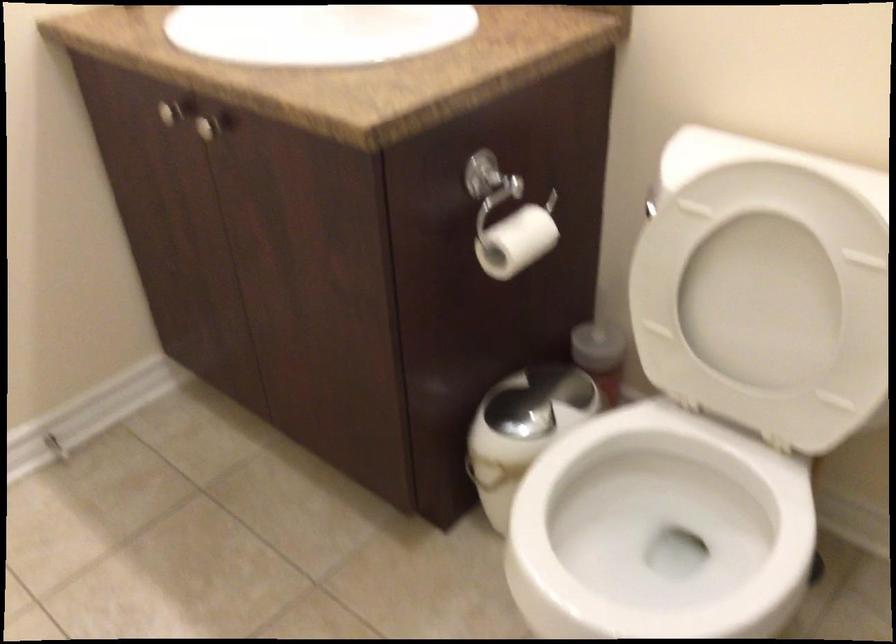
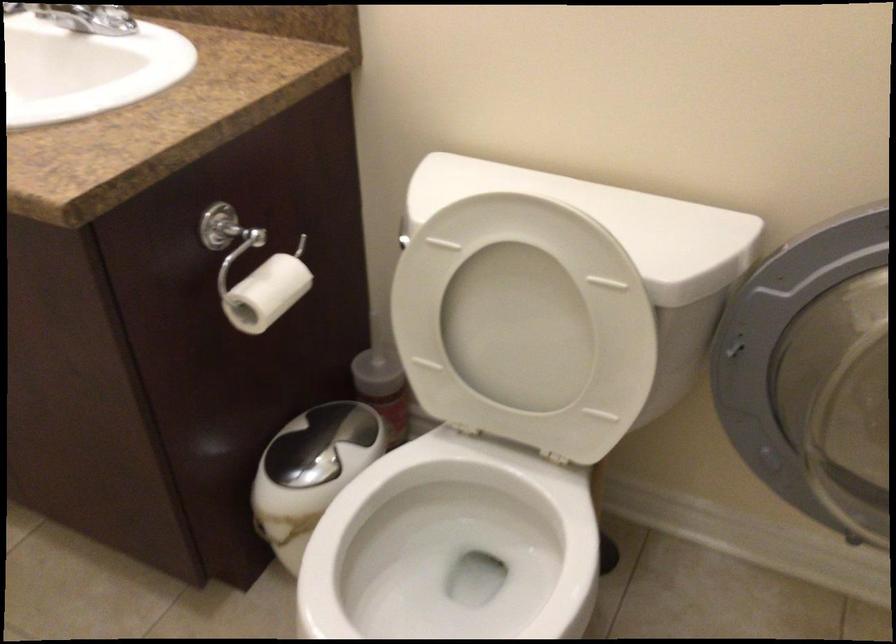
The point at (755, 299) is marked in the first image. Where is the corresponding point in the second image?

(517, 328)